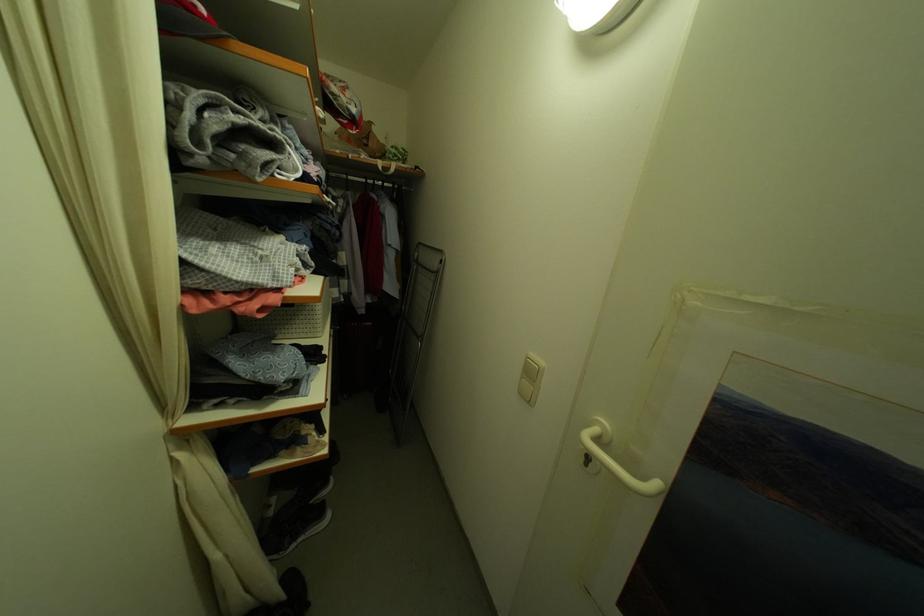
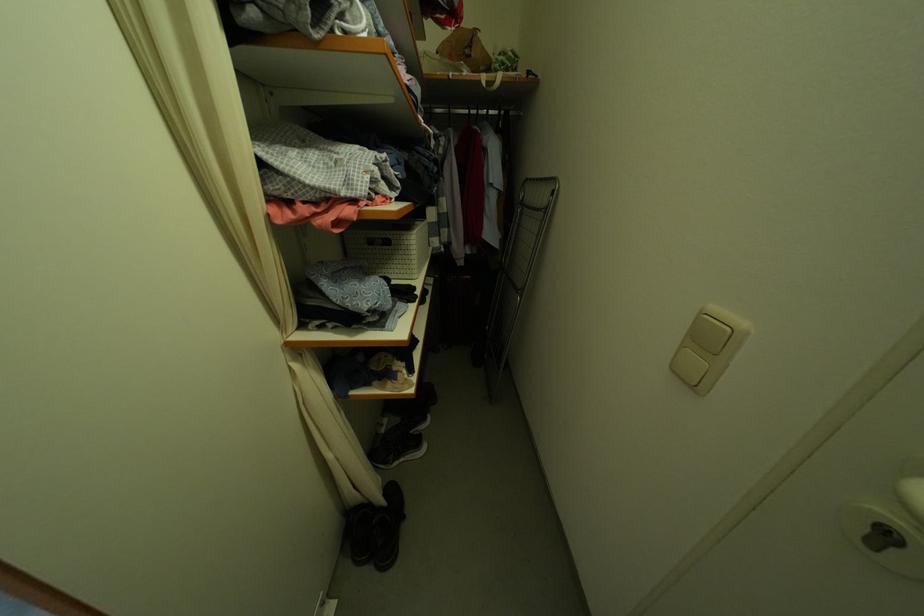
The point at (294, 580) is marked in the first image. Where is the corresponding point in the second image?

(395, 490)